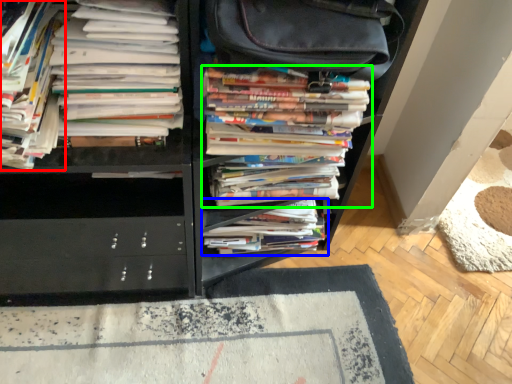
Question: Which is farther away from book (highlighted by a red box)? book (highlighted by a blue box) or book (highlighted by a green box)?

Choices:
 (A) book
 (B) book

Answer: (A)